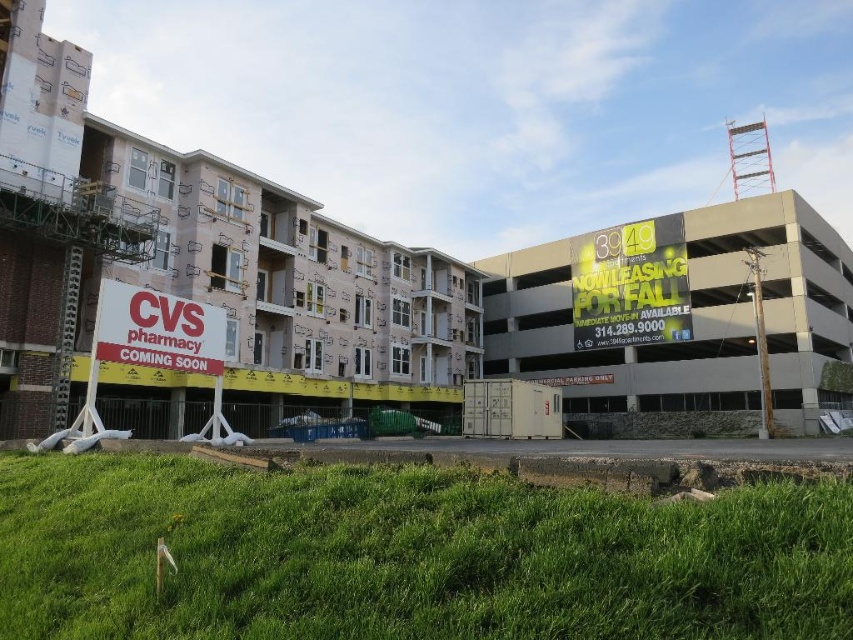
Is gray concrete parking garage at right bigger than white plastic cvs pharmacy sign at lower left?

Correct, gray concrete parking garage at right is larger in size than white plastic cvs pharmacy sign at lower left.

Between gray concrete parking garage at right and white plastic cvs pharmacy sign at lower left, which one appears on the left side from the viewer's perspective?

Positioned to the left is white plastic cvs pharmacy sign at lower left.

Who is more distant from viewer, (x=781, y=284) or (x=120, y=330)?

The point (x=781, y=284) is behind.

Identify the location of gray concrete parking garage at right. (692, 321).

Based on the photo, can you confirm if gray concrete parking garage at right is taller than yellow reflective sign at upper right?

Correct, gray concrete parking garage at right is much taller as yellow reflective sign at upper right.

Is gray concrete parking garage at right shorter than yellow reflective sign at upper right?

In fact, gray concrete parking garage at right may be taller than yellow reflective sign at upper right.

Is point (804, 368) behind point (679, 337)?

No, it is not.

This screenshot has width=853, height=640. I want to click on gray concrete parking garage at right, so click(692, 321).

Is point (585, 308) less distant than point (102, 355)?

No, it is behind (102, 355).

Where is `yellow reflective sign at upper right`? This screenshot has height=640, width=853. yellow reflective sign at upper right is located at coordinates (631, 285).

This screenshot has width=853, height=640. Find the location of `yellow reflective sign at upper right`. yellow reflective sign at upper right is located at coordinates (631, 285).